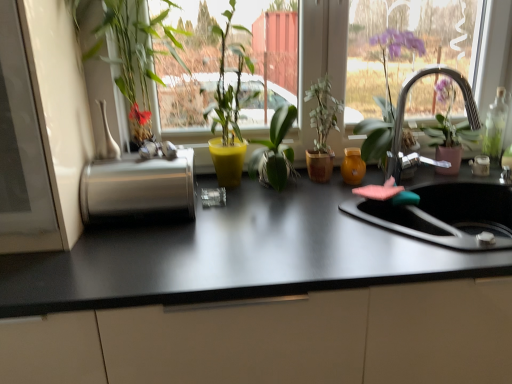
Question: Is green matte plant at center, which is the second houseplant from right to left, bigger than green matte plant at center, which is the first houseplant in right-to-left order?

Choices:
 (A) yes
 (B) no

Answer: (A)

Question: Does green matte plant at center, which is the second houseplant from right to left, lie behind green matte plant at center, the fourth houseplant from the left?

Choices:
 (A) no
 (B) yes

Answer: (A)

Question: Is green matte plant at center, which is the second houseplant from right to left, far from green matte plant at center, the fourth houseplant from the left?

Choices:
 (A) yes
 (B) no

Answer: (B)

Question: Can you confirm if green matte plant at center, which is the second houseplant from right to left, is wider than green matte plant at center, the fourth houseplant from the left?

Choices:
 (A) yes
 (B) no

Answer: (A)

Question: Is green matte plant at center, the 3th houseplant from the left, completely or partially outside of green matte plant at center, the fourth houseplant from the left?

Choices:
 (A) yes
 (B) no

Answer: (A)

Question: Is green matte plant at center, which is the second houseplant from right to left, positioned with its back to green matte plant at center, the fourth houseplant from the left?

Choices:
 (A) no
 (B) yes

Answer: (A)

Question: Does matte yellow pot at center, positioned as the 3th houseplant in right-to-left order, lie in front of black matte countertop at center?

Choices:
 (A) yes
 (B) no

Answer: (B)

Question: Can you confirm if matte yellow pot at center, positioned as the 3th houseplant in right-to-left order, is smaller than black matte countertop at center?

Choices:
 (A) yes
 (B) no

Answer: (A)

Question: Is the surface of matte yellow pot at center, acting as the second houseplant starting from the left, in direct contact with black matte countertop at center?

Choices:
 (A) no
 (B) yes

Answer: (A)

Question: Is matte yellow pot at center, positioned as the 3th houseplant in right-to-left order, outside of black matte countertop at center?

Choices:
 (A) yes
 (B) no

Answer: (A)

Question: Is matte yellow pot at center, acting as the second houseplant starting from the left, oriented away from black matte countertop at center?

Choices:
 (A) yes
 (B) no

Answer: (B)

Question: Can you confirm if matte yellow pot at center, acting as the second houseplant starting from the left, is bigger than black matte countertop at center?

Choices:
 (A) no
 (B) yes

Answer: (A)

Question: Is silver metallic faucet at upper right to the left of transparent glass bottle at right from the viewer's perspective?

Choices:
 (A) yes
 (B) no

Answer: (A)